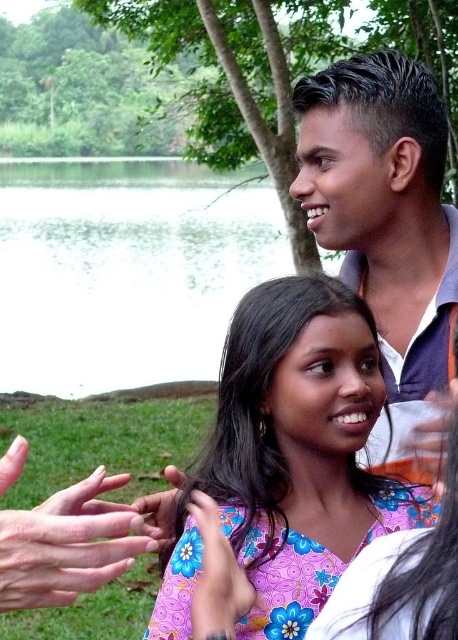
Question: Which of the following is the farthest from the observer?

Choices:
 (A) (98, 512)
 (B) (180, 202)
 (C) (363, 150)

Answer: (B)

Question: Among these points, which one is nearest to the camera?

Choices:
 (A) (369, 522)
 (B) (5, 474)
 (C) (420, 280)

Answer: (B)

Question: Does matte purple shirt at upper right have a lesser width compared to smooth skin hand at lower left?

Choices:
 (A) no
 (B) yes

Answer: (A)

Question: Can you confirm if green water at center is positioned to the right of matte purple shirt at upper right?

Choices:
 (A) yes
 (B) no

Answer: (B)

Question: Among these points, which one is nearest to the camera?

Choices:
 (A) (244, 172)
 (B) (294, 467)
 (C) (343, 124)

Answer: (B)

Question: Can you confirm if green water at center is smaller than matte purple shirt at upper right?

Choices:
 (A) no
 (B) yes

Answer: (A)